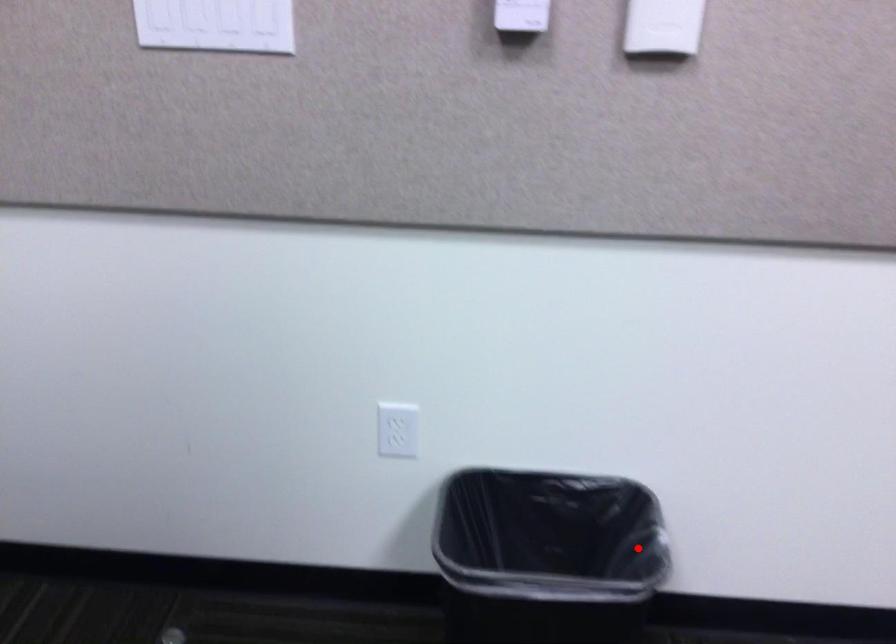
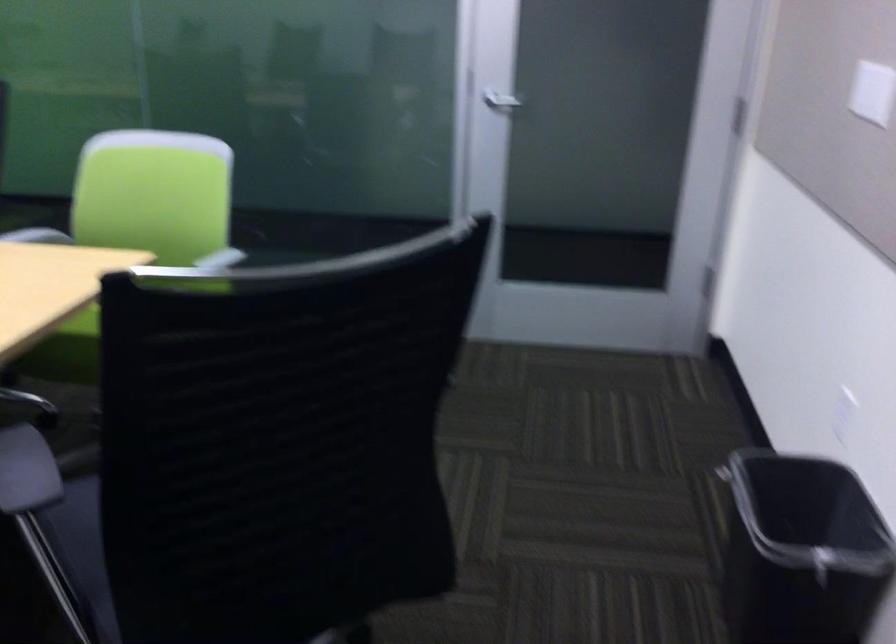
Find the pixel in the second image that matches the highlighted location in the first image.

(800, 552)